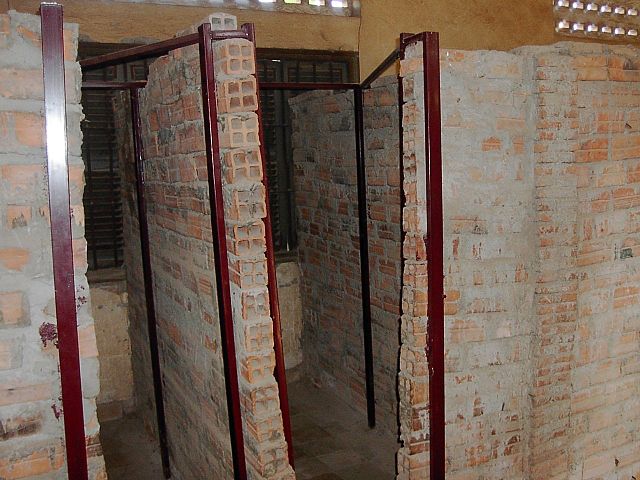
You are a GUI agent. You are given a task and a screenshot of the screen. Output one action in this format:
    pyautogui.click(x=<x>, y=<y>)
    Task: Click on the window
    The height and width of the screenshot is (480, 640).
    Given the screenshot: What is the action you would take?
    pyautogui.click(x=109, y=256), pyautogui.click(x=285, y=245)